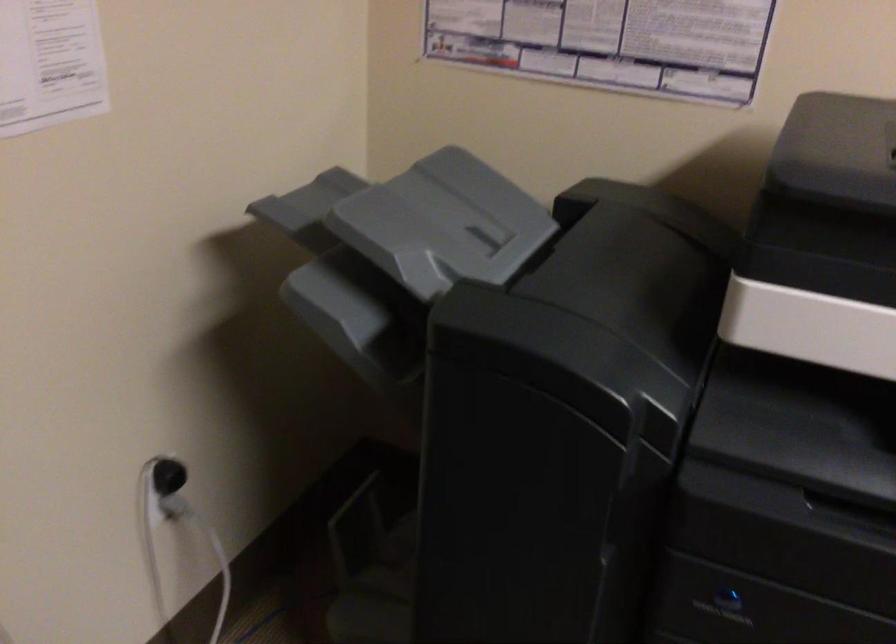
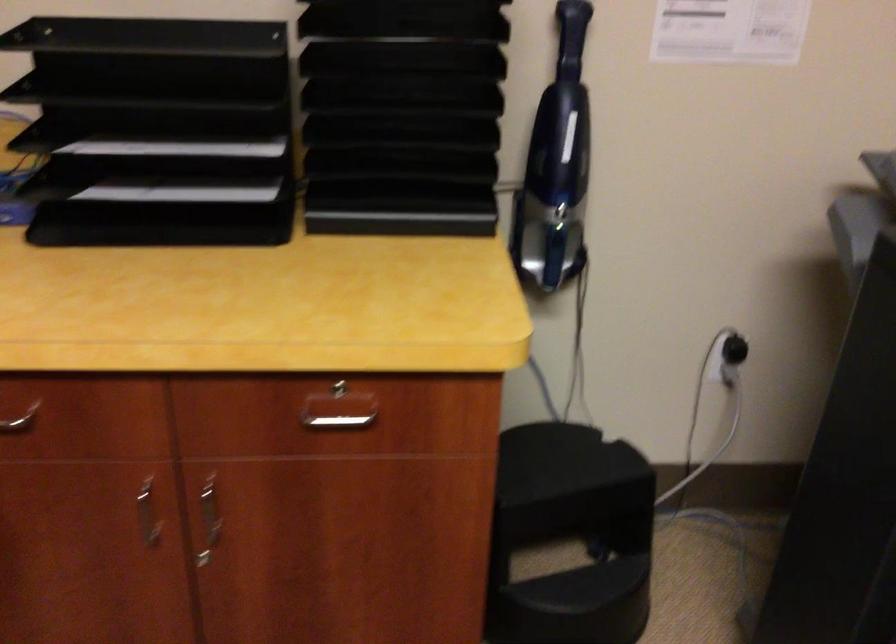
Locate, in the second image, the point that corresponds to [166,486] in the first image.

(730, 357)